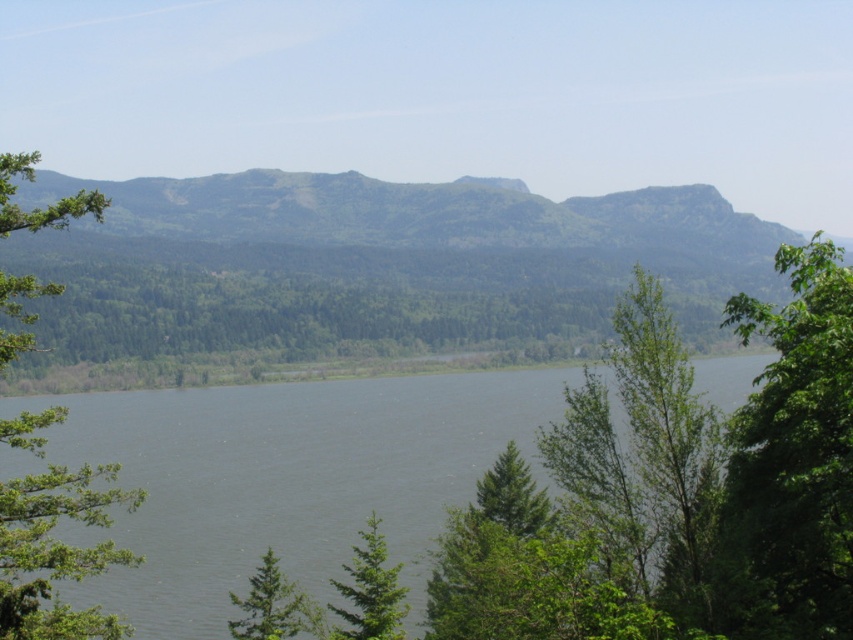
You are standing at the edge of the landscape and want to determine which object is taller between the green textured mountain at center and the gray water at center. Based on the scene, which one is taller?

The green textured mountain at center is taller than the gray water at center.

You are standing at the center of the image and want to locate the green leafy tree at left. In which direction should you look to find it?

The green leafy tree at left is located at point coordinates of (55, 552), so you should look to the left side of the image to find it.